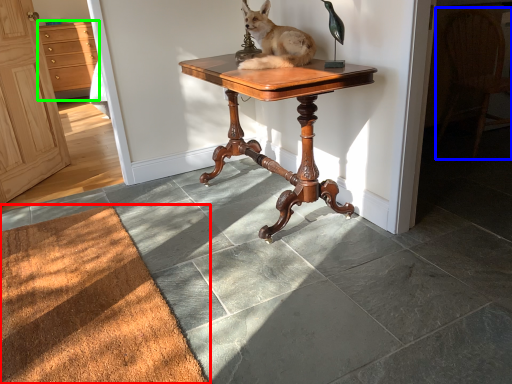
Question: Considering the real-world distances, which object is closest to doormat (highlighted by a red box)? chair (highlighted by a blue box) or cabinetry (highlighted by a green box).

Choices:
 (A) chair
 (B) cabinetry

Answer: (A)